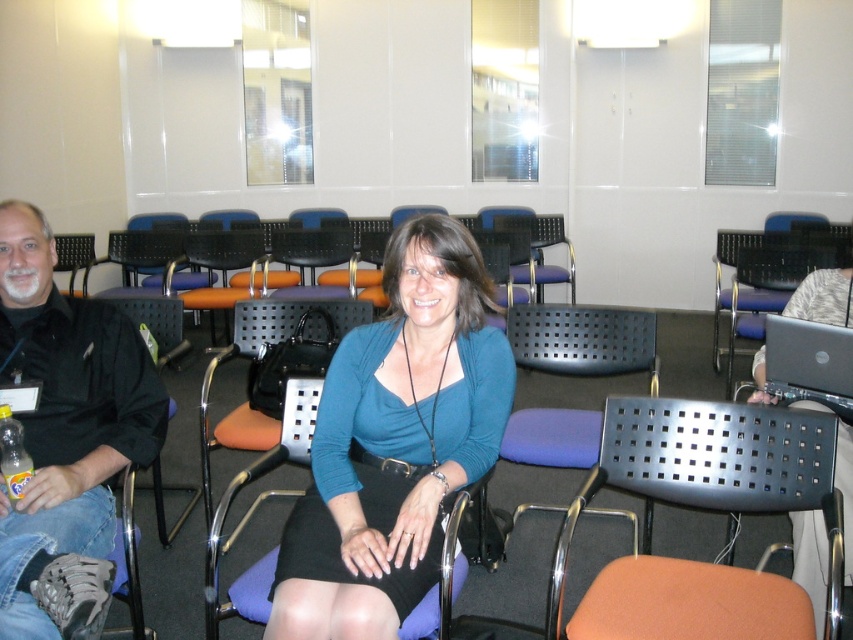
You are attending a virtual meeting and see the teal matte shirt at center and the black glossy laptop at right in the scene. Which object is located to the right of the other?

The black glossy laptop at right is located to the right of the teal matte shirt at center.